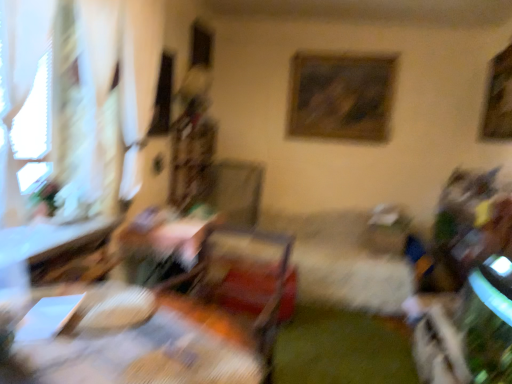
The width and height of the screenshot is (512, 384). What are the coordinates of `free space above wooden table at center, marked as the second table in a back-to-front arrangement (from a real-world perspective)` in the screenshot? It's located at [x=121, y=330].